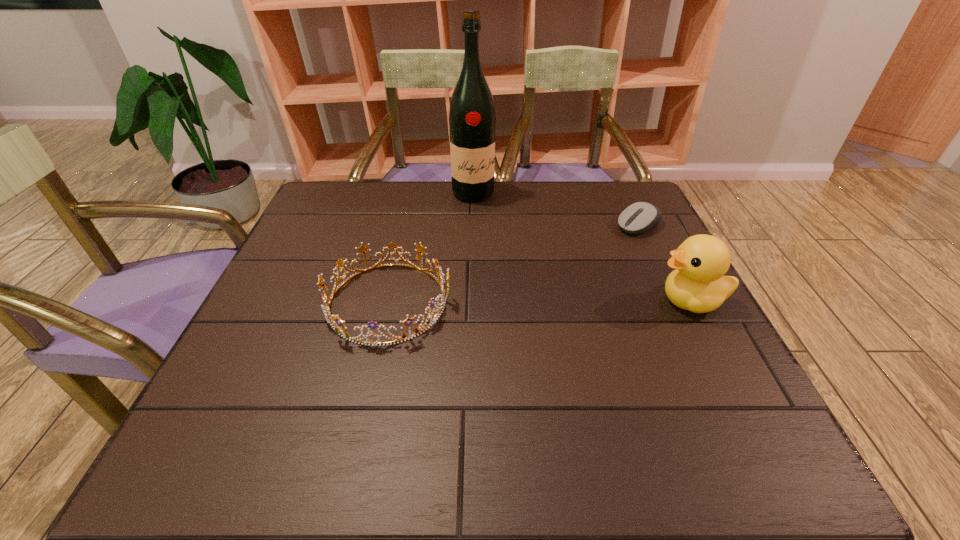
At what (x,y) coordinates should I click in order to perform the action: click on computer equipment at the right edge. Please return your answer as a coordinate pair (x, y). The image size is (960, 540). Looking at the image, I should click on (639, 217).

You are a GUI agent. You are given a task and a screenshot of the screen. Output one action in this format:
    pyautogui.click(x=<x>, y=<y>)
    Task: Click on the object present at the far right corner
    The width and height of the screenshot is (960, 540).
    Given the screenshot: What is the action you would take?
    pyautogui.click(x=639, y=217)

What are the coordinates of `vacant space at the far edge of the desktop` in the screenshot? It's located at (396, 203).

In the image, there is a desktop. Identify the location of vacant space at the near edge. The width and height of the screenshot is (960, 540). (364, 400).

Identify the location of free space at the left edge of the desktop. Image resolution: width=960 pixels, height=540 pixels. (267, 287).

Image resolution: width=960 pixels, height=540 pixels. Identify the location of vacant space at the right edge. (667, 297).

In order to click on vacant space at the near left corner in this screenshot , I will do `click(216, 392)`.

Image resolution: width=960 pixels, height=540 pixels. Identify the location of vacant space in between the shortest object and the tiara. (513, 264).

You are a GUI agent. You are given a task and a screenshot of the screen. Output one action in this format:
    pyautogui.click(x=<x>, y=<y>)
    Task: Click on the unoccupied area between the second farthest object and the second tallest object
    
    Given the screenshot: What is the action you would take?
    pyautogui.click(x=664, y=263)

Image resolution: width=960 pixels, height=540 pixels. I want to click on free spot between the third shortest object and the second farthest object, so click(664, 263).